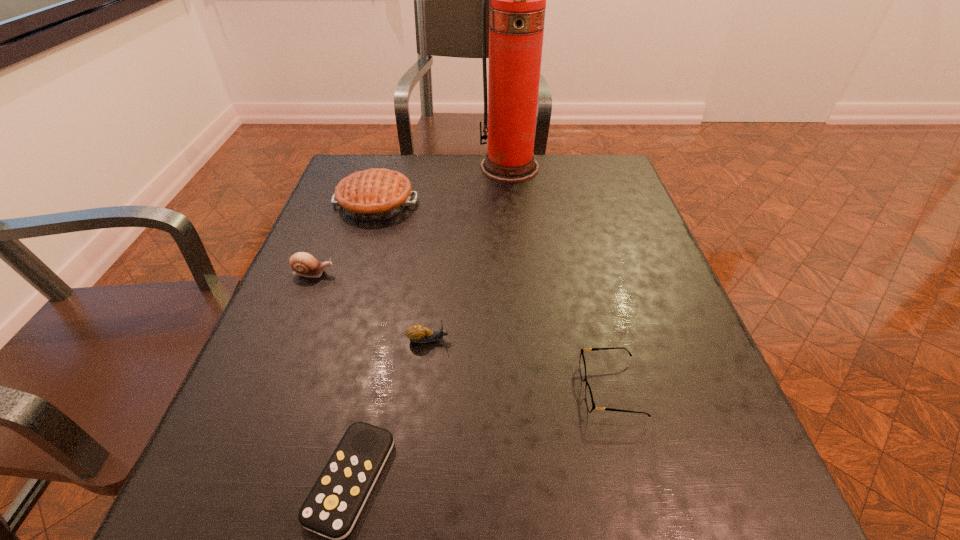
At what (x,y) coordinates should I click in order to perform the action: click on escargot that is at the left edge. Please return your answer as a coordinate pair (x, y). This screenshot has width=960, height=540. Looking at the image, I should click on (304, 264).

The width and height of the screenshot is (960, 540). I want to click on object present at the right edge, so click(590, 403).

This screenshot has height=540, width=960. I want to click on object situated at the far left corner, so click(376, 194).

Locate an element on the screen. The width and height of the screenshot is (960, 540). free space at the far edge of the desktop is located at coordinates (401, 157).

Locate an element on the screen. free region at the left edge of the desktop is located at coordinates (267, 357).

At what (x,y) coordinates should I click in order to perform the action: click on vacant area at the right edge. Please return your answer as a coordinate pair (x, y). Looking at the image, I should click on (607, 292).

The width and height of the screenshot is (960, 540). In the image, there is a desktop. What are the coordinates of `vacant space at the near left corner` in the screenshot? It's located at (249, 501).

In the image, there is a desktop. At what (x,y) coordinates should I click in order to perform the action: click on free space at the far right corner. Please return your answer as a coordinate pair (x, y). This screenshot has width=960, height=540. Looking at the image, I should click on (615, 192).

You are a GUI agent. You are given a task and a screenshot of the screen. Output one action in this format:
    pyautogui.click(x=<x>, y=<y>)
    Task: Click on the vacant space at the near right corner of the desktop
    This screenshot has width=960, height=540.
    Given the screenshot: What is the action you would take?
    [x=718, y=526]

At what (x,y) coordinates should I click in order to perform the action: click on free spot between the second object from right to left and the fourth shortest object. Please return your answer as a coordinate pair (x, y). This screenshot has height=540, width=960. Looking at the image, I should click on (412, 220).